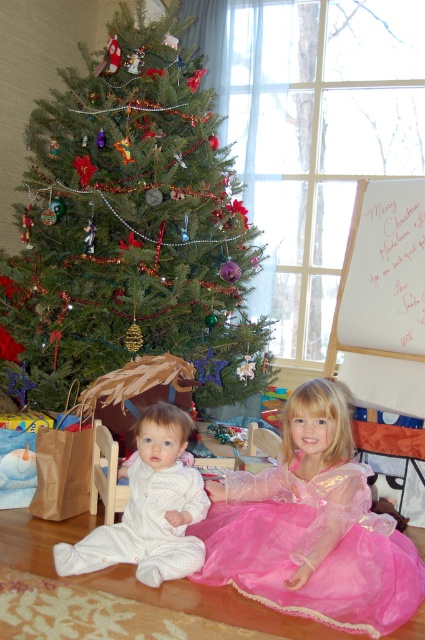
Who is higher up, green matte christmas tree at upper left or pink tulle dress at lower center?

→ green matte christmas tree at upper left

Who is taller, green matte christmas tree at upper left or pink tulle dress at lower center?

green matte christmas tree at upper left is taller.

Who is more forward, (133,246) or (280,524)?

Point (280,524) is in front.

What are the coordinates of `green matte christmas tree at upper left` in the screenshot? It's located at (130, 228).

Which of these two, pink tulle dress at lower center or white soft pajamas at lower left, stands shorter?

With less height is pink tulle dress at lower center.

Does pink tulle dress at lower center have a greater height compared to white soft pajamas at lower left?

No.

Is point (337, 547) closer to camera compared to point (161, 464)?

Yes, it is in front of point (161, 464).

This screenshot has width=425, height=640. Find the location of `pink tulle dress at lower center`. pink tulle dress at lower center is located at coordinates (311, 548).

Is green matte christmas tree at upper left above white soft pajamas at lower left?

Yes.

Looking at this image, does green matte christmas tree at upper left come in front of white soft pajamas at lower left?

No, green matte christmas tree at upper left is behind white soft pajamas at lower left.

Describe the element at coordinates (130, 228) in the screenshot. I see `green matte christmas tree at upper left` at that location.

This screenshot has height=640, width=425. In order to click on green matte christmas tree at upper left in this screenshot , I will do `click(130, 228)`.